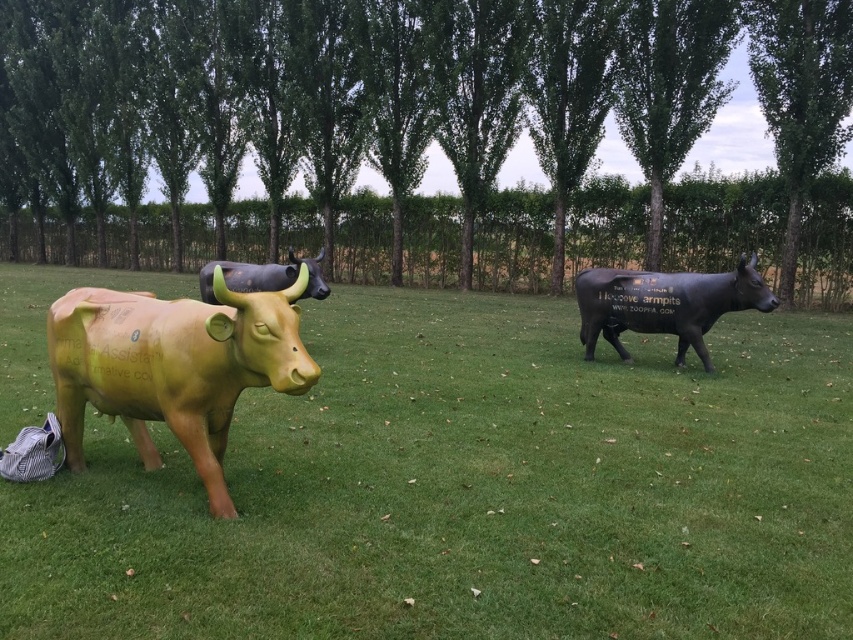
Question: Does green grass at center appear on the left side of matte black bull at center?

Choices:
 (A) no
 (B) yes

Answer: (A)

Question: Which point is farther to the camera?

Choices:
 (A) (283, 356)
 (B) (340, 435)
 (C) (674, 276)

Answer: (C)

Question: Which of the following is the closest to the observer?

Choices:
 (A) (323, 296)
 (B) (827, 429)
 (C) (743, 262)

Answer: (B)

Question: Can you confirm if green grass at center is bigger than matte black bull at right?

Choices:
 (A) yes
 (B) no

Answer: (A)

Question: Considering the relative positions of matte yellow bull at left and matte black bull at center in the image provided, where is matte yellow bull at left located with respect to matte black bull at center?

Choices:
 (A) below
 (B) above

Answer: (A)

Question: Which object appears closest to the camera in this image?

Choices:
 (A) matte black bull at center
 (B) matte black bull at right

Answer: (A)